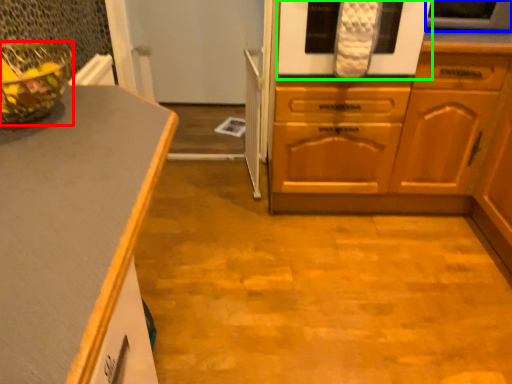
Question: Estimate the real-world distances between objects in this image. Which object is farther from glass bowl (highlighted by a red box), appliance (highlighted by a blue box) or oven (highlighted by a green box)?

Choices:
 (A) appliance
 (B) oven

Answer: (A)